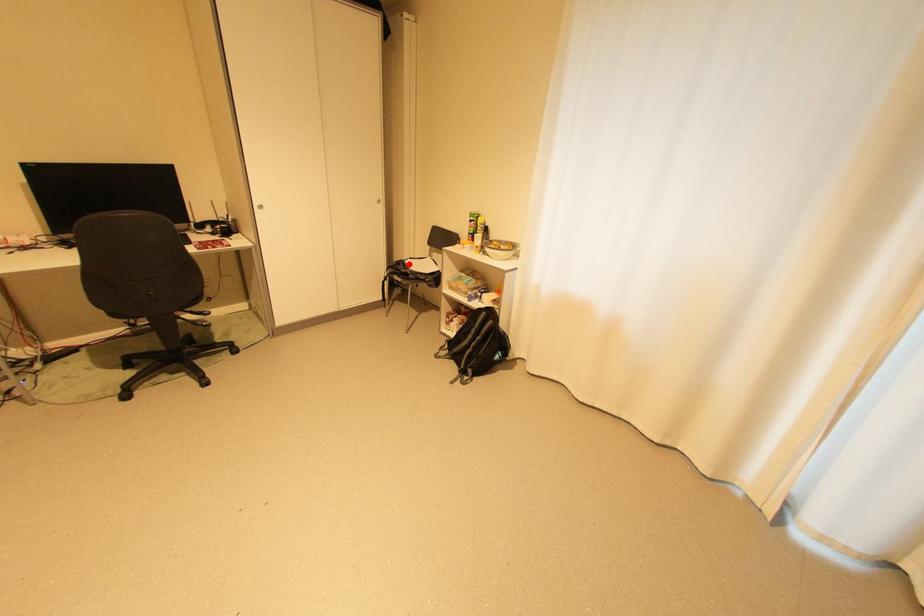
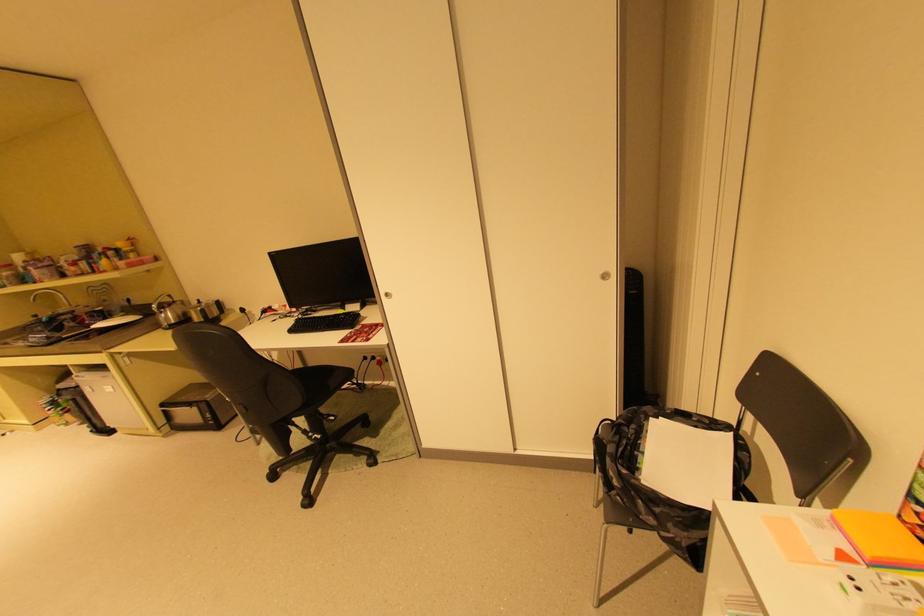
Find the pixel in the second image that matches the highlighted location in the first image.

(640, 427)